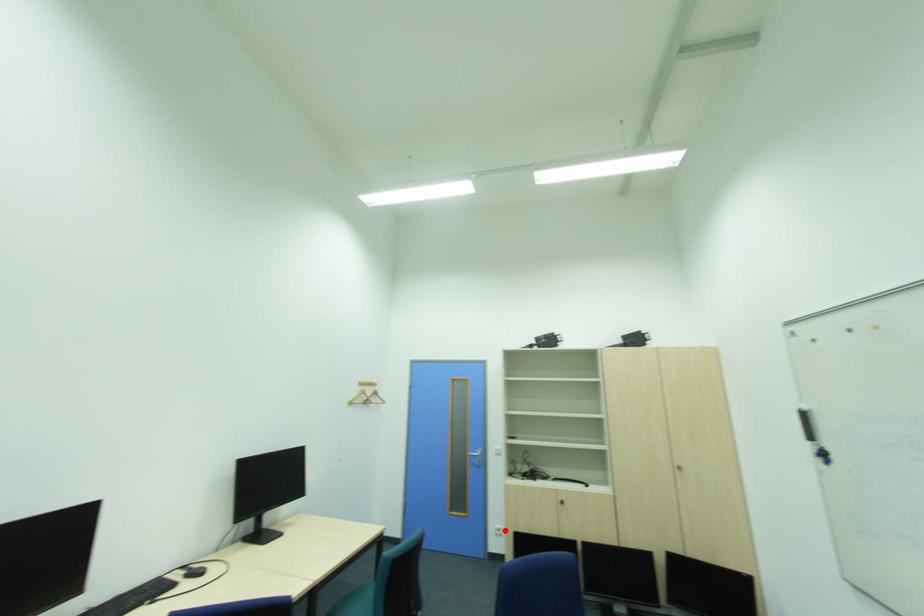
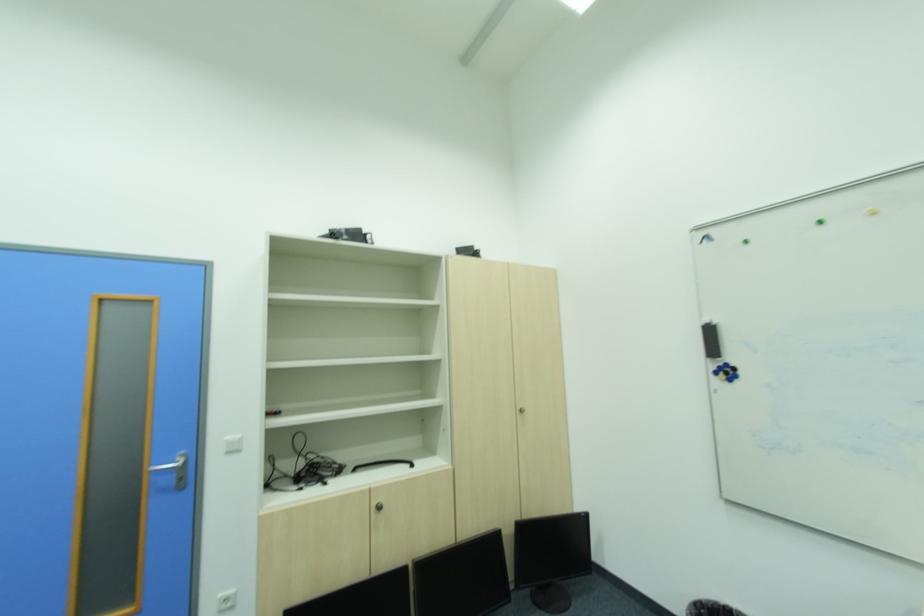
In the second image, find the point that corresponds to the highlighted location in the first image.

(234, 602)